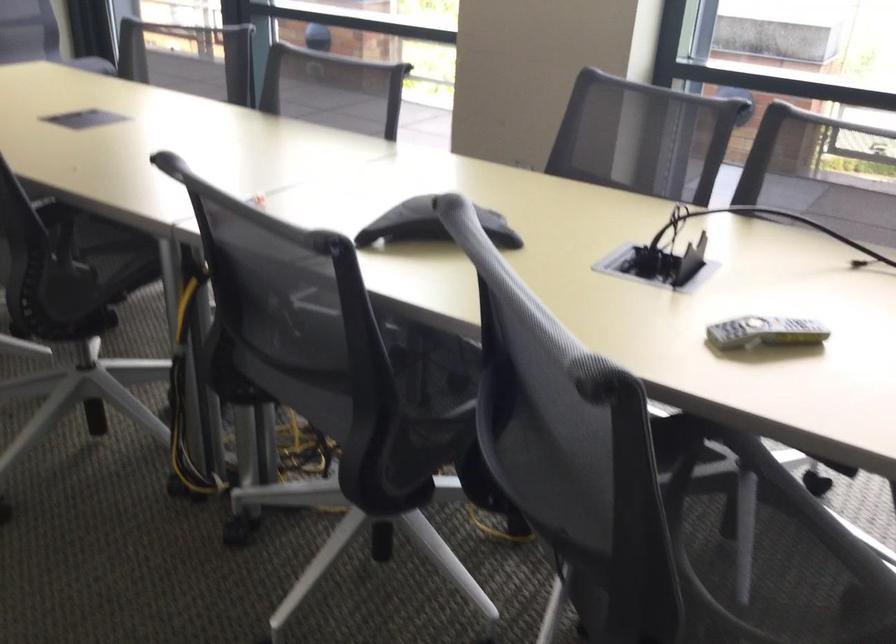
Find where to push the black conference phone. Please return your answer as a coordinate pair (x, y).

(431, 225)